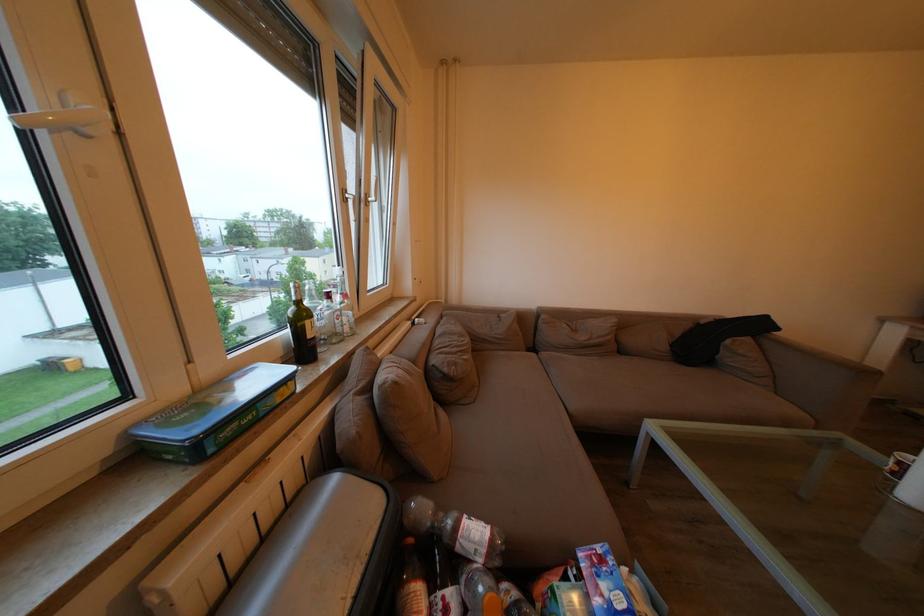
Where would you sit the sofa sitting surface? Please return your answer as a coordinate pair (x, y).

(660, 392)